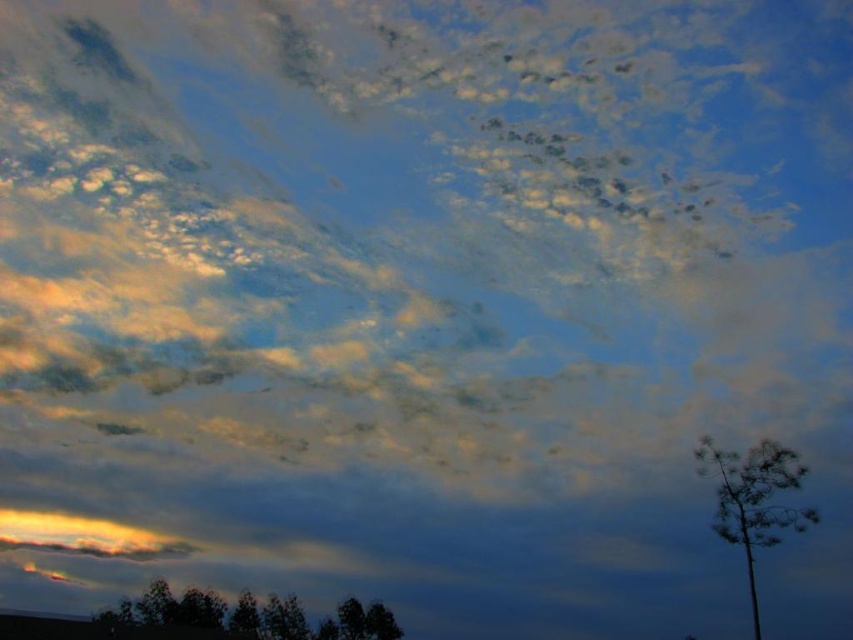
Question: From the image, what is the correct spatial relationship of dark green leafy tree at lower center in relation to silhouette bark tree at right?

Choices:
 (A) left
 (B) right

Answer: (A)

Question: Does dark green leafy tree at lower center appear over silhouette bark tree at right?

Choices:
 (A) no
 (B) yes

Answer: (A)

Question: Is the position of dark green leafy tree at lower center less distant than that of silhouette bark tree at right?

Choices:
 (A) no
 (B) yes

Answer: (B)

Question: Which of the following is the farthest from the observer?

Choices:
 (A) (170, 614)
 (B) (753, 525)

Answer: (A)